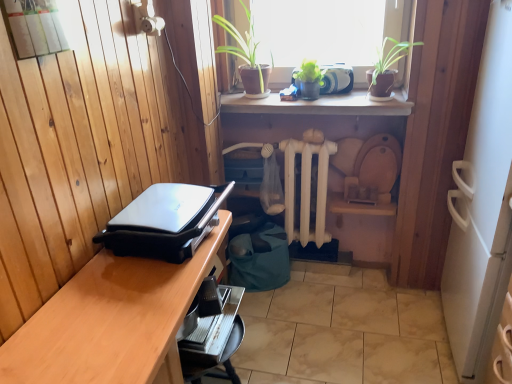
Describe the element at coordinates (112, 321) in the screenshot. This screenshot has width=512, height=384. I see `wooden desk at lower left` at that location.

The width and height of the screenshot is (512, 384). What do you see at coordinates (247, 57) in the screenshot?
I see `green matte plant at upper center` at bounding box center [247, 57].

This screenshot has width=512, height=384. What do you see at coordinates (309, 73) in the screenshot?
I see `green matte plant at upper center` at bounding box center [309, 73].

Image resolution: width=512 pixels, height=384 pixels. What do you see at coordinates (166, 222) in the screenshot? I see `black plastic grill at left` at bounding box center [166, 222].

I want to click on white wooden radiator at center, so click(x=307, y=185).

The width and height of the screenshot is (512, 384). I want to click on green leafy plants at upper center, so click(x=319, y=33).

You are a GUI agent. You are given a task and a screenshot of the screen. Output one action in this format:
    pyautogui.click(x=<x>, y=<y>)
    Task: Click on the wooden desk at lower left
    This screenshot has width=512, height=384.
    Given the screenshot: What is the action you would take?
    pyautogui.click(x=112, y=321)

This screenshot has height=384, width=512. In the image, there is a wooden desk at lower left. Find the location of `houseplant above it (from the image's perspective)`. houseplant above it (from the image's perspective) is located at coordinates (247, 57).

From the image's perspective, which object appears higher, wooden desk at lower left or green matte plant at upper center?

green matte plant at upper center appears higher in the image.

Does wooden desk at lower left have a lesser height compared to green matte plant at upper center?

Incorrect, the height of wooden desk at lower left does not fall short of that of green matte plant at upper center.

Based on the photo, does wooden desk at lower left turn towards green matte plant at upper center?

No, wooden desk at lower left is not turned towards green matte plant at upper center.

Is green matte plant at upper center next to green leafy plants at upper center?

green matte plant at upper center and green leafy plants at upper center are not in contact.

In the image, is green matte plant at upper center on the left side or the right side of green leafy plants at upper center?

Clearly, green matte plant at upper center is on the left of green leafy plants at upper center in the image.

From a real-world perspective, is green matte plant at upper center located beneath green leafy plants at upper center?

Yes, from a real-world perspective, green matte plant at upper center is under green leafy plants at upper center.

Does green matte plant at upper center come behind green leafy plants at upper center?

No, it is not.

Relative to black plastic grill at left, is green leafy plants at upper center in front or behind?

green leafy plants at upper center is positioned farther from the viewer than black plastic grill at left.

Which object is wider, green leafy plants at upper center or black plastic grill at left?

With larger width is black plastic grill at left.

Is green leafy plants at upper center positioned beyond the bounds of black plastic grill at left?

Yes.

What's the angular difference between green leafy plants at upper center and black plastic grill at left's facing directions?

88.5 degrees.

Consider the image. In terms of height, does green leafy plants at upper center look taller or shorter compared to wooden desk at lower left?

Clearly, green leafy plants at upper center is shorter compared to wooden desk at lower left.

Is green leafy plants at upper center smaller than wooden desk at lower left?

Yes, green leafy plants at upper center is smaller than wooden desk at lower left.

Is green leafy plants at upper center looking in the opposite direction of wooden desk at lower left?

No, wooden desk at lower left is not at the back of green leafy plants at upper center.

Who is smaller, wooden desk at lower left or black plastic grill at left?

black plastic grill at left is smaller.

Could you tell me if wooden desk at lower left is turned towards black plastic grill at left?

No, wooden desk at lower left is not turned towards black plastic grill at left.

Is black plastic grill at left completely or partially inside wooden desk at lower left?

That's incorrect, black plastic grill at left is not inside wooden desk at lower left.

How different are the orientations of wooden desk at lower left and black plastic grill at left in degrees?

0.71 degrees separate the facing orientations of wooden desk at lower left and black plastic grill at left.

Who is smaller, white wooden radiator at center or green leafy plants at upper center?

Smaller between the two is green leafy plants at upper center.

Measure the distance from white wooden radiator at center to green leafy plants at upper center.

white wooden radiator at center and green leafy plants at upper center are 19.44 inches apart from each other.

Which is in front, white wooden radiator at center or green leafy plants at upper center?

green leafy plants at upper center.

Is white wooden radiator at center turned away from green leafy plants at upper center?

No, white wooden radiator at center is not facing away from green leafy plants at upper center.

Is black plastic grill at left far from green matte plant at upper center?

black plastic grill at left is near green matte plant at upper center, not far away.

Does point (142, 226) come farther from viewer compared to point (292, 77)?

That is False.

What's the angular difference between black plastic grill at left and green matte plant at upper center's facing directions?

The angle between the facing direction of black plastic grill at left and the facing direction of green matte plant at upper center is 88.9 degrees.

From a real-world perspective, which object rests below the other?

In real-world perspective, black plastic grill at left is lower.

What are the coordinates of `desk lying on the left of green matte plant at upper center` in the screenshot? It's located at (112, 321).

The image size is (512, 384). Find the location of `window that is above the green matte plant at upper center (from a real-world perspective)`. window that is above the green matte plant at upper center (from a real-world perspective) is located at coordinates (319, 33).

When comparing their distances from green leafy plants at upper center, does wooden desk at lower left or white wooden radiator at center seem further?

Among the two, wooden desk at lower left is located further to green leafy plants at upper center.

In the scene shown: Which object lies nearer to the anchor point black plastic grill at left, green matte plant at upper center or green matte plant at upper center?

Based on the image, green matte plant at upper center appears to be nearer to black plastic grill at left.

Looking at this image, based on their spatial positions, is black plastic grill at left or white wooden radiator at center further from green leafy plants at upper center?

Based on the image, black plastic grill at left appears to be further to green leafy plants at upper center.

Estimate the real-world distances between objects in this image. Which object is further from wooden desk at lower left, green matte plant at upper center or black plastic grill at left?

green matte plant at upper center lies further to wooden desk at lower left than the other object.

Looking at the image, which one is located closer to green leafy plants at upper center, green matte plant at upper center or white wooden radiator at center?

The object closer to green leafy plants at upper center is green matte plant at upper center.

From the picture: Based on their spatial positions, is green matte plant at upper center or black plastic grill at left closer to green matte plant at upper center?

green matte plant at upper center is closer to green matte plant at upper center.

Looking at the image, which one is located further to white wooden radiator at center, green matte plant at upper center or black plastic grill at left?

Based on the image, black plastic grill at left appears to be further to white wooden radiator at center.

Looking at this image, based on their spatial positions, is white wooden radiator at center or wooden desk at lower left further from black plastic grill at left?

white wooden radiator at center is further to black plastic grill at left.

Locate an element on the screen. The height and width of the screenshot is (384, 512). plant between green leafy plants at upper center and wooden desk at lower left from top to bottom is located at coordinates (309, 73).

Locate an element on the screen. The height and width of the screenshot is (384, 512). houseplant that lies between green leafy plants at upper center and wooden desk at lower left from top to bottom is located at coordinates (247, 57).

Find the location of a particular element. Image resolution: width=512 pixels, height=384 pixels. plant that lies between green matte plant at upper center and white wooden radiator at center from top to bottom is located at coordinates (309, 73).

At what (x,y) coordinates should I click in order to perform the action: click on window located between black plastic grill at left and white wooden radiator at center in the depth direction. Please return your answer as a coordinate pair (x, y). Looking at the image, I should click on (319, 33).